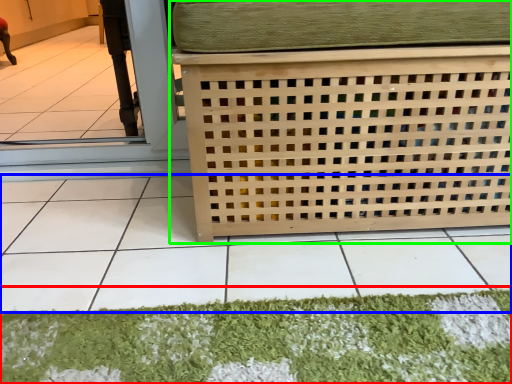
Question: Which object is positioned closest to mat (highlighted by a red box)? Select from tile (highlighted by a blue box) and furniture (highlighted by a green box).

Choices:
 (A) tile
 (B) furniture

Answer: (A)